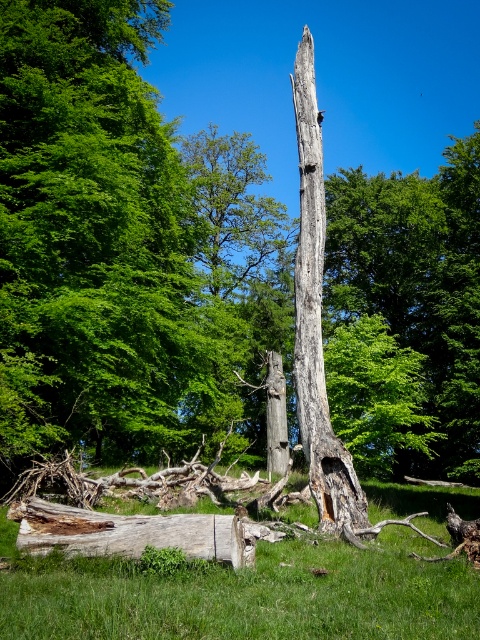
Between point (108, 195) and point (229, 520), which one is positioned behind?

Point (108, 195)

Does dead wood trunk at center have a lesser width compared to weathered wood log at lower left?

No.

Identify the location of dead wood trunk at center. This screenshot has height=640, width=480. (93, 236).

Is green grass at center bigger than weathered wood log at lower left?

Yes.

Find the location of a particular element. Image resolution: width=480 pixels, height=640 pixels. green grass at center is located at coordinates (244, 595).

Which is in front, point (173, 580) or point (227, 529)?

Point (173, 580)

Where is `green grass at center`? The image size is (480, 640). green grass at center is located at coordinates (244, 595).

Measure the distance from dead wood trunk at center to gray rough bark tree trunk at center.

26.06 feet

Can you confirm if dead wood trunk at center is positioned below gray rough bark tree trunk at center?

Yes, dead wood trunk at center is below gray rough bark tree trunk at center.

Is point (139, 200) behind point (308, 237)?

That is True.

Identify the location of dead wood trunk at center. The height and width of the screenshot is (640, 480). 93,236.